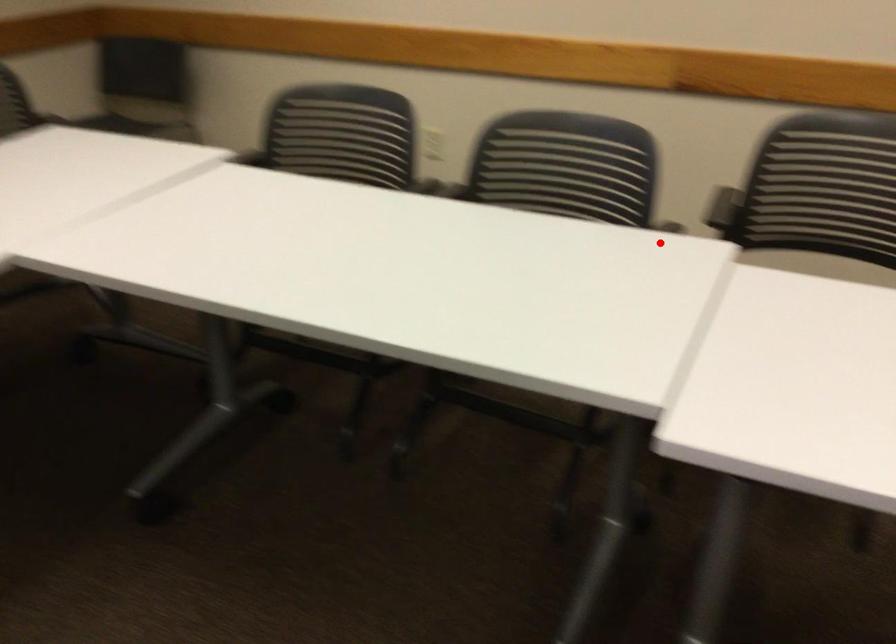
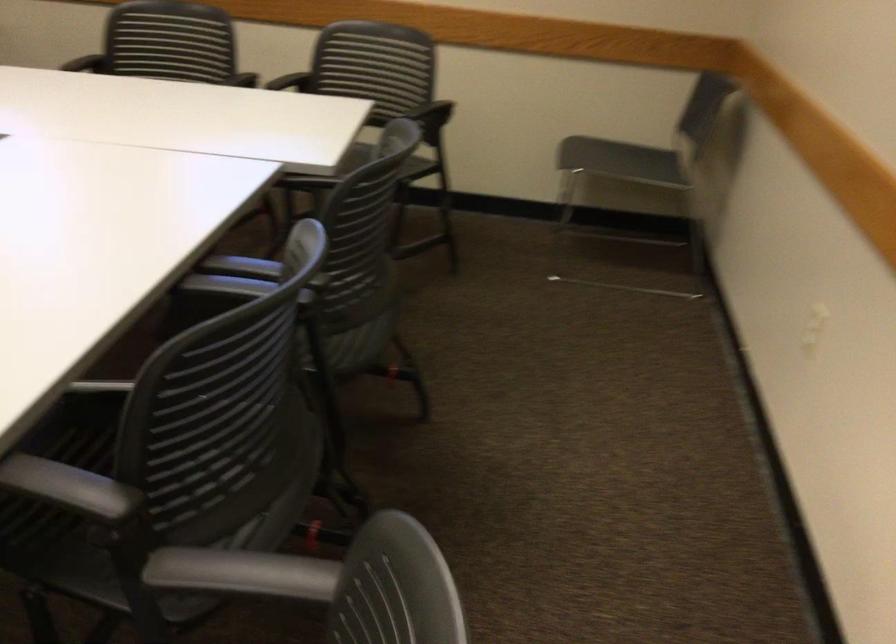
The point at the highlighted location is marked in the first image. Where is the corresponding point in the second image?

(71, 488)